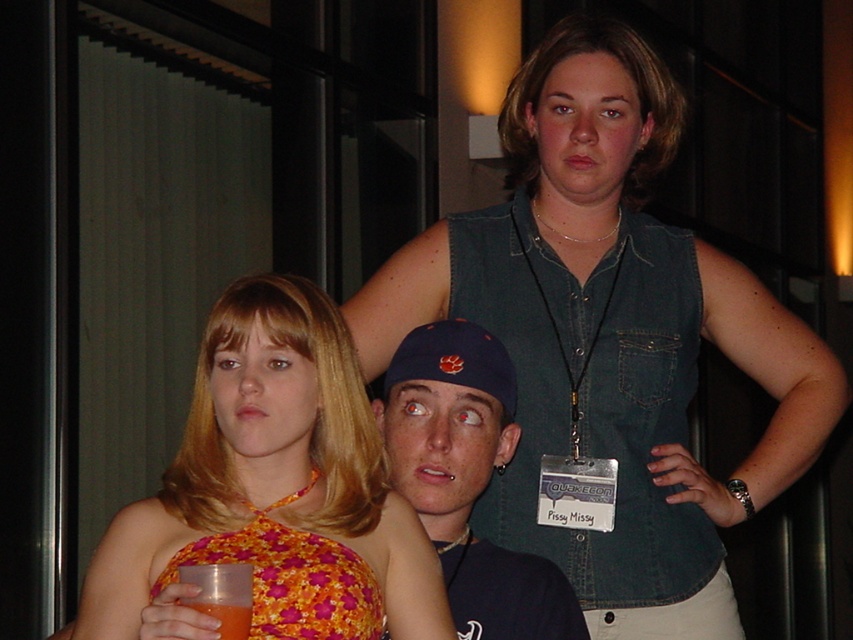
Image resolution: width=853 pixels, height=640 pixels. Describe the element at coordinates (610, 337) in the screenshot. I see `denim vest at upper center` at that location.

Does denim vest at upper center appear on the right side of floral print fabric dress at center?

Correct, you'll find denim vest at upper center to the right of floral print fabric dress at center.

Describe the element at coordinates (610, 337) in the screenshot. This screenshot has height=640, width=853. I see `denim vest at upper center` at that location.

Find the location of a particular element. The image size is (853, 640). denim vest at upper center is located at coordinates (610, 337).

Is floral print fabric dress at center closer to the viewer compared to translucent plastic cup at lower left?

No, floral print fabric dress at center is behind translucent plastic cup at lower left.

Is point (329, 624) more distant than point (222, 611)?

Yes, it is behind point (222, 611).

The width and height of the screenshot is (853, 640). Identify the location of floral print fabric dress at center. [x=291, y=577].

From the picture: Does matte blue cap at center have a smaller size compared to translucent plastic cup at lower left?

Actually, matte blue cap at center might be larger than translucent plastic cup at lower left.

Which is more to the left, matte blue cap at center or translucent plastic cup at lower left?

From the viewer's perspective, translucent plastic cup at lower left appears more on the left side.

Does point (480, 333) come farther from viewer compared to point (196, 596)?

That is True.

I want to click on matte blue cap at center, so click(x=467, y=480).